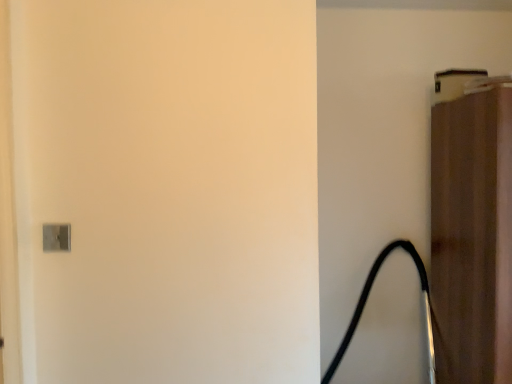
Question: Considering the positions of brown fabric door at upper right and black rubber hose at right in the image, is brown fabric door at upper right bigger or smaller than black rubber hose at right?

Choices:
 (A) big
 (B) small

Answer: (A)

Question: Considering the positions of brown fabric door at upper right and black rubber hose at right in the image, is brown fabric door at upper right taller or shorter than black rubber hose at right?

Choices:
 (A) tall
 (B) short

Answer: (A)

Question: From the image's perspective, is brown fabric door at upper right positioned above or below black rubber hose at right?

Choices:
 (A) above
 (B) below

Answer: (A)

Question: Visually, is black rubber hose at right positioned to the left or to the right of brown fabric door at upper right?

Choices:
 (A) left
 (B) right

Answer: (A)

Question: Considering the positions of black rubber hose at right and brown fabric door at upper right in the image, is black rubber hose at right taller or shorter than brown fabric door at upper right?

Choices:
 (A) short
 (B) tall

Answer: (A)

Question: In terms of size, does black rubber hose at right appear bigger or smaller than brown fabric door at upper right?

Choices:
 (A) small
 (B) big

Answer: (A)

Question: From the image's perspective, is black rubber hose at right positioned above or below brown fabric door at upper right?

Choices:
 (A) below
 (B) above

Answer: (A)